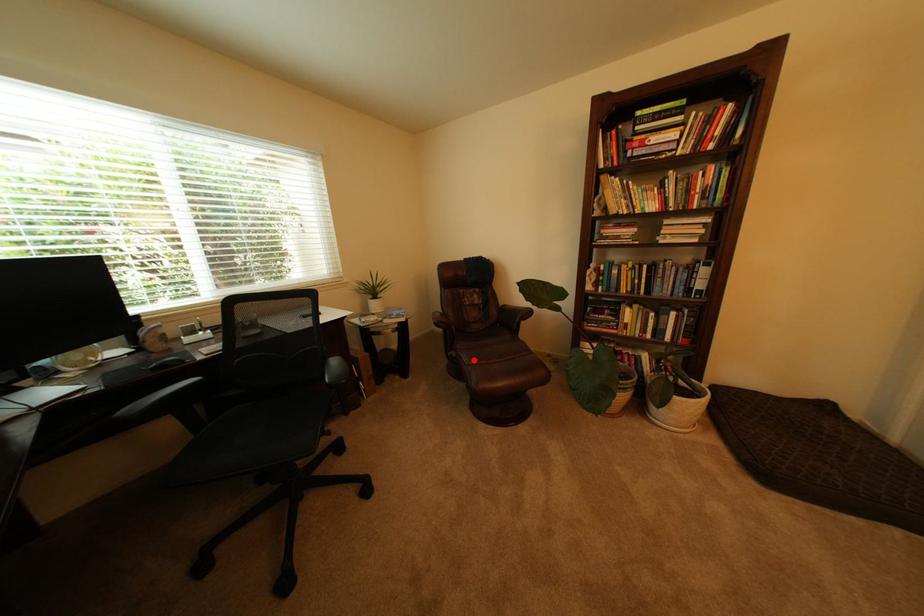
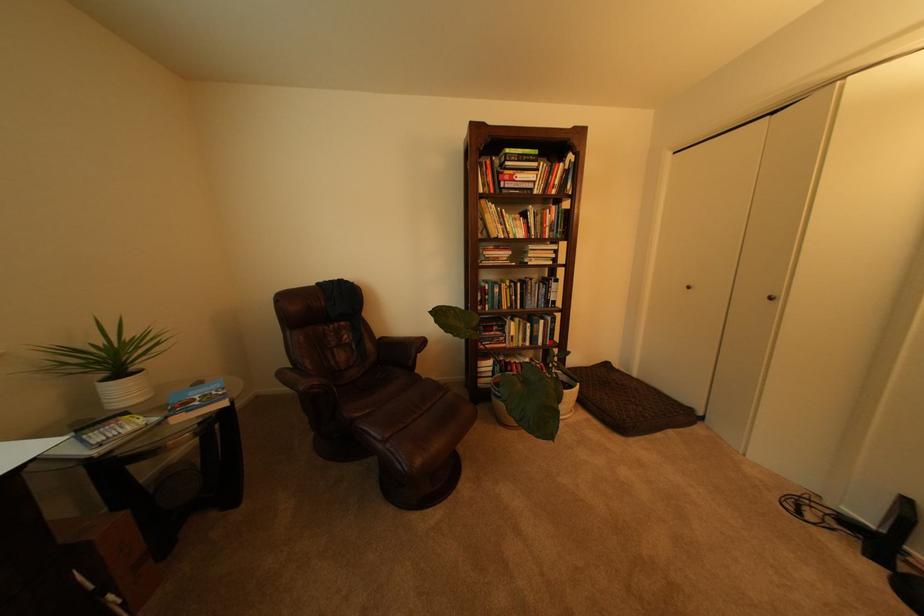
Where in the second image is the point corresponding to the highlighted location from the first image?

(383, 435)